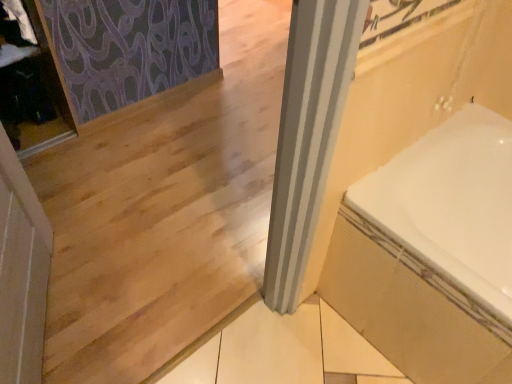
This screenshot has width=512, height=384. What are the coordinates of `white glossy bathtub at right` in the screenshot? It's located at (451, 204).

Image resolution: width=512 pixels, height=384 pixels. What do you see at coordinates (451, 204) in the screenshot? I see `white glossy bathtub at right` at bounding box center [451, 204].

What is the approximate height of white glossy bathtub at right?

white glossy bathtub at right is 21.13 inches tall.

Find the location of `white glossy bathtub at right`. white glossy bathtub at right is located at coordinates (451, 204).